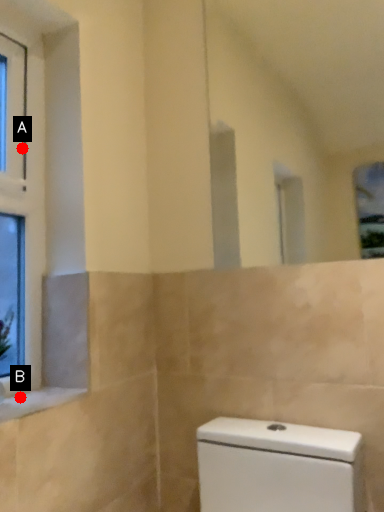
Question: Two points are circled on the image, labeled by A and B beside each circle. Which point is closer to the camera?

Choices:
 (A) A is closer
 (B) B is closer

Answer: (B)